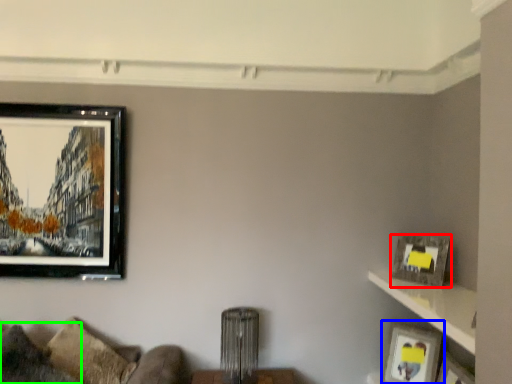
Question: Considering the real-world distances, which object is closest to picture frame (highlighted by a red box)? picture frame (highlighted by a blue box) or pillow (highlighted by a green box).

Choices:
 (A) picture frame
 (B) pillow

Answer: (A)